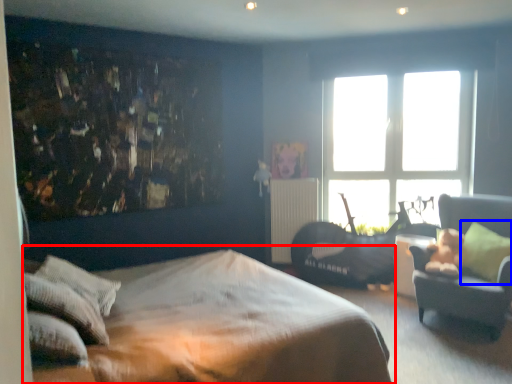
Question: Among these objects, which one is nearest to the camera, bed (highlighted by a red box) or pillow (highlighted by a blue box)?

Choices:
 (A) bed
 (B) pillow

Answer: (A)